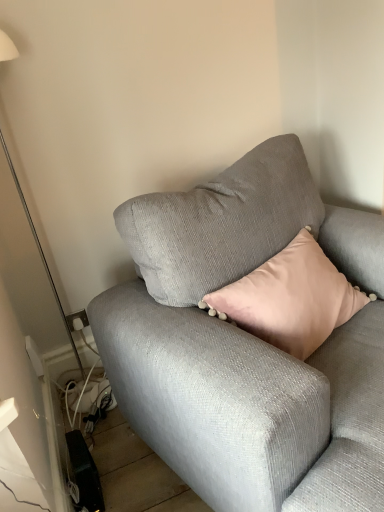
Question: Is textured gray couch at center taller than white glossy floor lamp at left?

Choices:
 (A) yes
 (B) no

Answer: (B)

Question: Considering the relative positions of textured gray couch at center and white glossy floor lamp at left in the image provided, is textured gray couch at center to the right of white glossy floor lamp at left from the viewer's perspective?

Choices:
 (A) no
 (B) yes

Answer: (B)

Question: Is textured gray couch at center positioned before white glossy floor lamp at left?

Choices:
 (A) no
 (B) yes

Answer: (B)

Question: Is textured gray couch at center facing towards white glossy floor lamp at left?

Choices:
 (A) no
 (B) yes

Answer: (A)

Question: Can we say textured gray couch at center lies outside white glossy floor lamp at left?

Choices:
 (A) no
 (B) yes

Answer: (B)

Question: From the image's perspective, is textured gray couch at center over white glossy floor lamp at left?

Choices:
 (A) no
 (B) yes

Answer: (A)

Question: Is white glossy floor lamp at left closer to the viewer compared to textured gray couch at center?

Choices:
 (A) yes
 (B) no

Answer: (B)

Question: Does white glossy floor lamp at left have a larger size compared to textured gray couch at center?

Choices:
 (A) no
 (B) yes

Answer: (A)

Question: Is white glossy floor lamp at left not inside textured gray couch at center?

Choices:
 (A) yes
 (B) no

Answer: (A)

Question: From the image's perspective, is white glossy floor lamp at left under textured gray couch at center?

Choices:
 (A) yes
 (B) no

Answer: (B)

Question: Can you confirm if white glossy floor lamp at left is taller than textured gray couch at center?

Choices:
 (A) no
 (B) yes

Answer: (B)

Question: Are white glossy floor lamp at left and textured gray couch at center making contact?

Choices:
 (A) yes
 (B) no

Answer: (B)

Question: From the image's perspective, is textured gray couch at center positioned above or below white glossy floor lamp at left?

Choices:
 (A) above
 (B) below

Answer: (B)